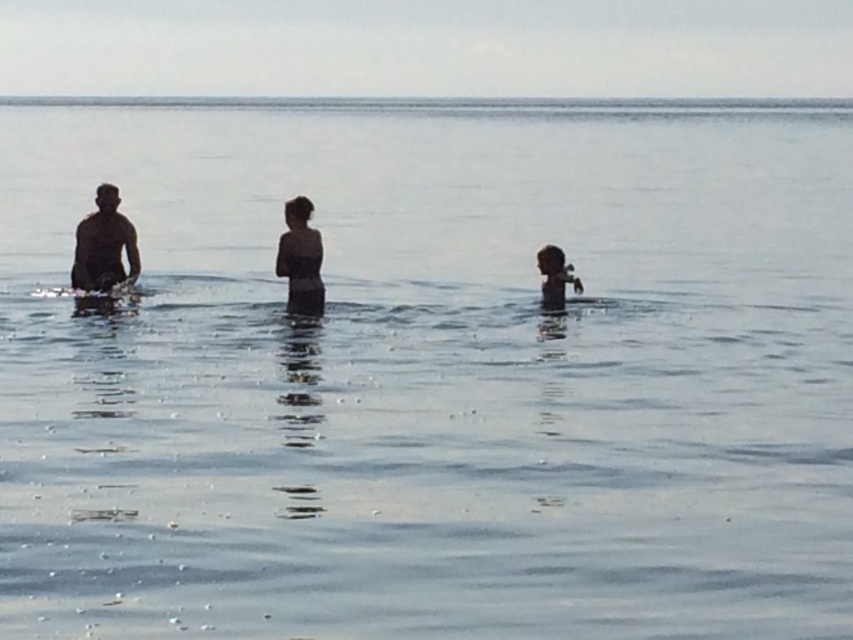
Question: Among these objects, which one is farthest from the camera?

Choices:
 (A) dark skin human at left
 (B) smooth skin child at right

Answer: (A)

Question: Is dark skin human at left to the left of smooth skin child at center from the viewer's perspective?

Choices:
 (A) no
 (B) yes

Answer: (B)

Question: Which of the following is the farthest from the observer?

Choices:
 (A) smooth skin child at right
 (B) smooth skin child at center

Answer: (A)

Question: Among these points, which one is farthest from the camera?

Choices:
 (A) (126, 227)
 (B) (548, 272)
 (C) (315, 241)

Answer: (A)

Question: Can you confirm if smooth skin child at center is positioned to the left of smooth skin child at right?

Choices:
 (A) no
 (B) yes

Answer: (B)

Question: Does smooth skin child at center have a greater width compared to smooth skin child at right?

Choices:
 (A) no
 (B) yes

Answer: (B)